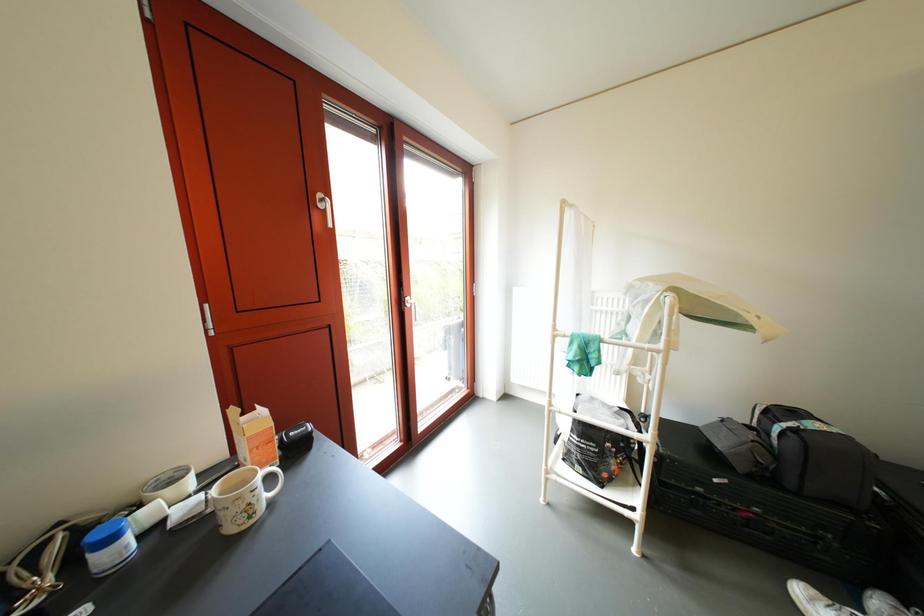
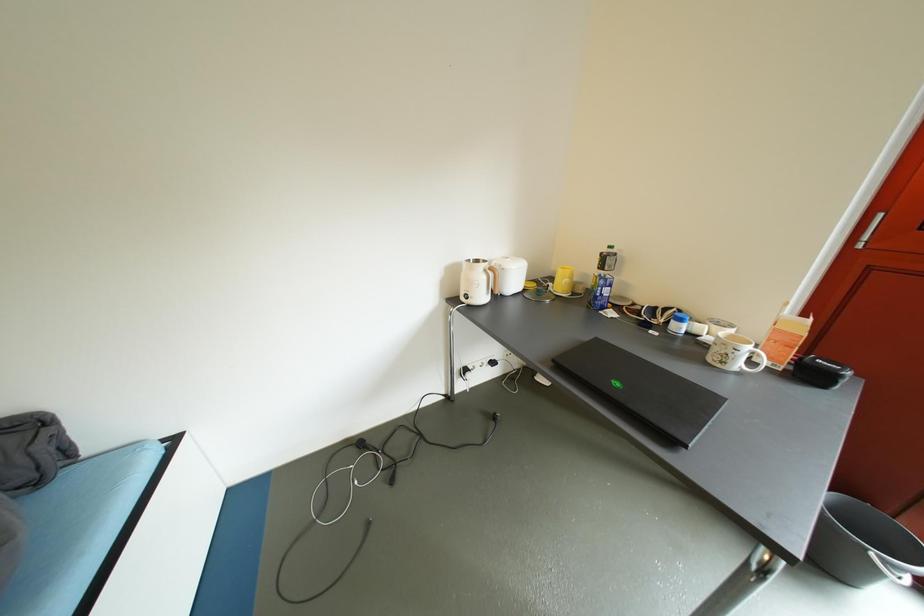
Based on the continuous images, in which direction is the camera rotating?

The rotation direction of the camera is left-down.